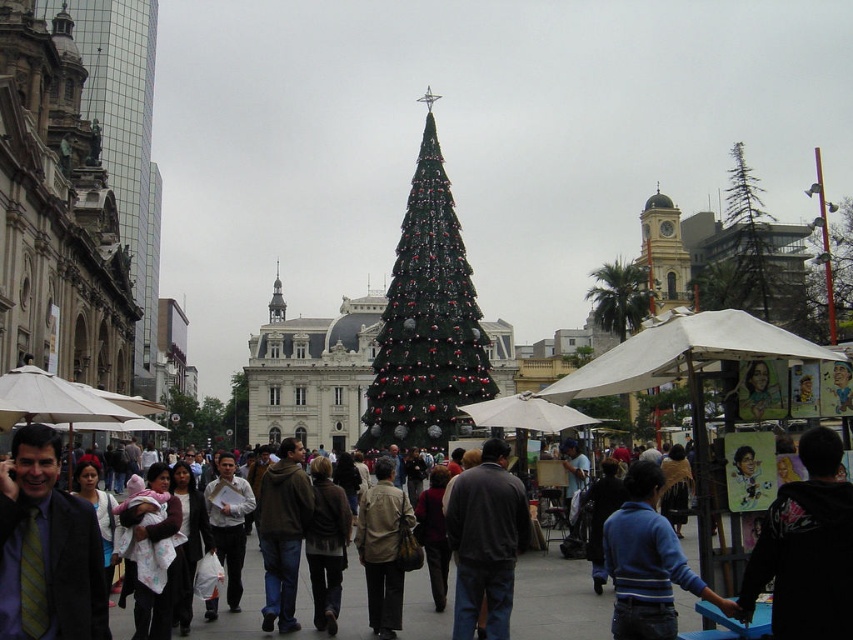
Who is lower down, green matte christmas tree at center or blue striped sweater at lower right?

blue striped sweater at lower right is below.

Is green matte christmas tree at center to the left of blue striped sweater at lower right from the viewer's perspective?

Yes, green matte christmas tree at center is to the left of blue striped sweater at lower right.

This screenshot has width=853, height=640. What do you see at coordinates (426, 320) in the screenshot?
I see `green matte christmas tree at center` at bounding box center [426, 320].

The image size is (853, 640). In order to click on green matte christmas tree at center in this screenshot , I will do `click(426, 320)`.

What do you see at coordinates (426, 320) in the screenshot?
I see `green matte christmas tree at center` at bounding box center [426, 320].

Between point (412, 188) and point (579, 600), which one is positioned in front?

Positioned in front is point (579, 600).

Where is `green matte christmas tree at center`? green matte christmas tree at center is located at coordinates (426, 320).

Who is taller, dark gray jacket at center or blue striped sweater at lower right?

With more height is dark gray jacket at center.

Can you confirm if dark gray jacket at center is positioned below blue striped sweater at lower right?

Yes.

The image size is (853, 640). What are the coordinates of `dark gray jacket at center` in the screenshot? It's located at (556, 600).

Locate an element on the screen. Image resolution: width=853 pixels, height=640 pixels. dark gray jacket at center is located at coordinates (556, 600).